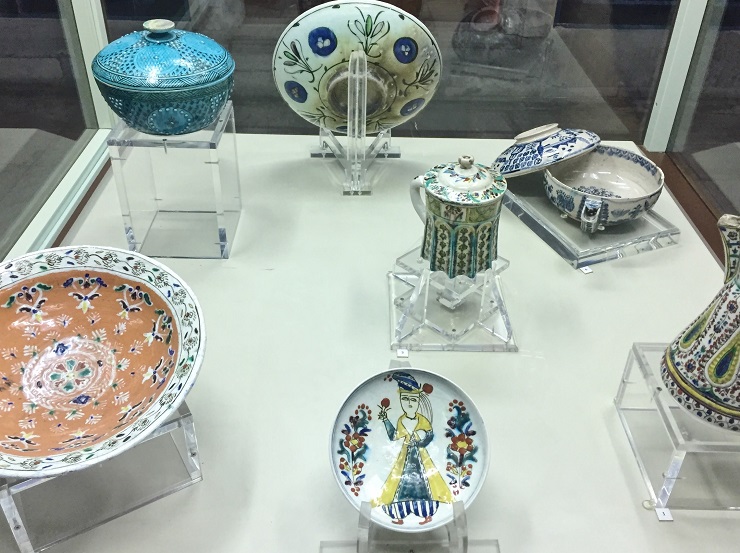
Locate an element on the screen. The width and height of the screenshot is (740, 553). plate is located at coordinates (149, 394).